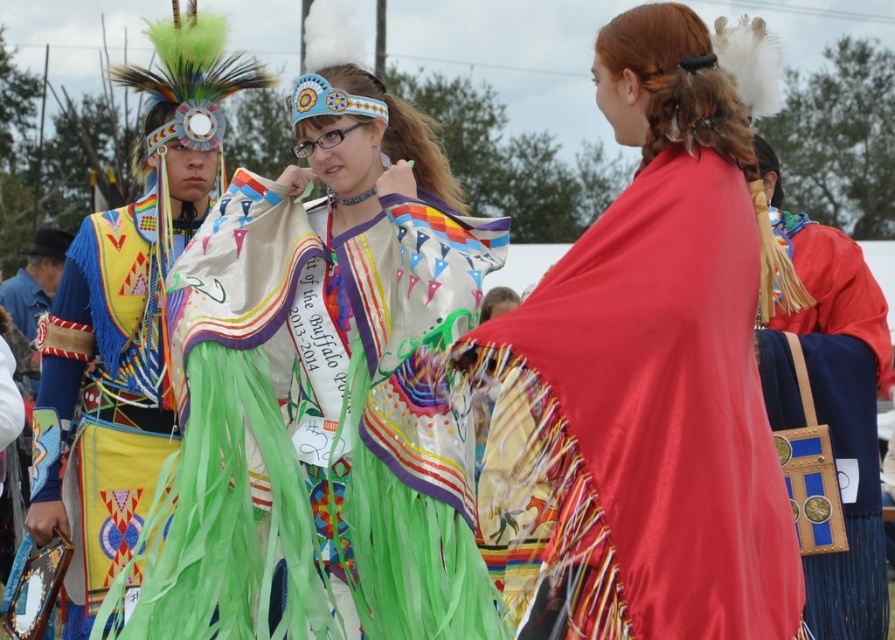
Question: Among these points, which one is farthest from the camera?

Choices:
 (A) (500, 516)
 (B) (780, 234)
 (C) (263, 227)
 (D) (64, 426)

Answer: (B)

Question: Which point is farther from the camera taking this photo?

Choices:
 (A) (135, 417)
 (B) (408, 586)
 (C) (768, 253)
 (D) (842, 541)

Answer: (A)

Question: Which point is farther to the camera?

Choices:
 (A) blue leather bag at right
 (B) shiny red cape at center
 (C) shiny satin dress at center
 (D) multicolored fabric vest at left

Answer: (D)

Question: Can you confirm if shiny satin dress at center is bigger than blue leather bag at right?

Choices:
 (A) yes
 (B) no

Answer: (A)

Question: In this image, where is shiny satin dress at center located relative to shiny red cape at center?

Choices:
 (A) right
 (B) left

Answer: (B)

Question: Can you confirm if multicolored fabric vest at left is thinner than blue leather bag at right?

Choices:
 (A) yes
 (B) no

Answer: (A)